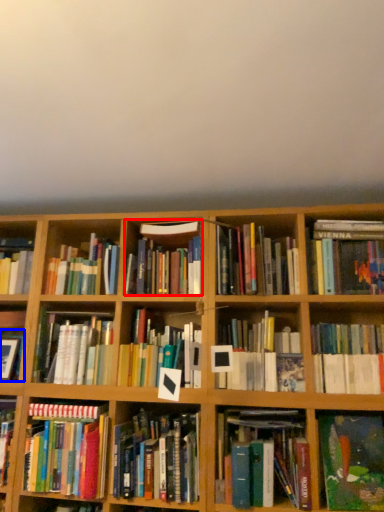
Question: Which point is closer to the camera, book (highlighted by a red box) or book (highlighted by a blue box)?

Choices:
 (A) book
 (B) book

Answer: (A)